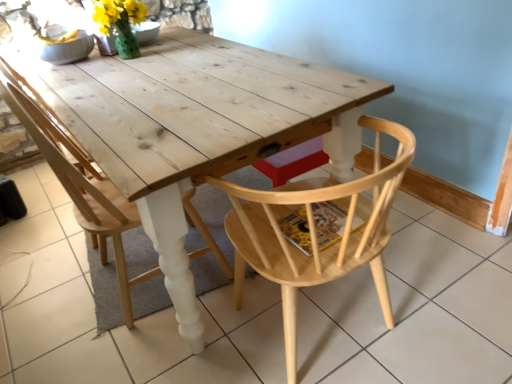
Question: Based on their positions, is natural wood chair at center, the 1th chair from the right, located to the left or right of natural wood chair at center, arranged as the 1th chair when viewed from the left?

Choices:
 (A) left
 (B) right

Answer: (B)

Question: In terms of size, does natural wood chair at center, the 1th chair from the right, appear bigger or smaller than natural wood chair at center, arranged as the 1th chair when viewed from the left?

Choices:
 (A) big
 (B) small

Answer: (B)

Question: Estimate the real-world distances between objects in this image. Which object is farther from the natural wood chair at center, the 1th chair from the right?

Choices:
 (A) natural wood chair at center, arranged as the 1th chair when viewed from the left
 (B) natural wood table at center

Answer: (A)

Question: Based on their relative distances, which object is nearer to the natural wood table at center?

Choices:
 (A) natural wood chair at center, the 1th chair from the right
 (B) natural wood chair at center, arranged as the 1th chair when viewed from the left

Answer: (B)